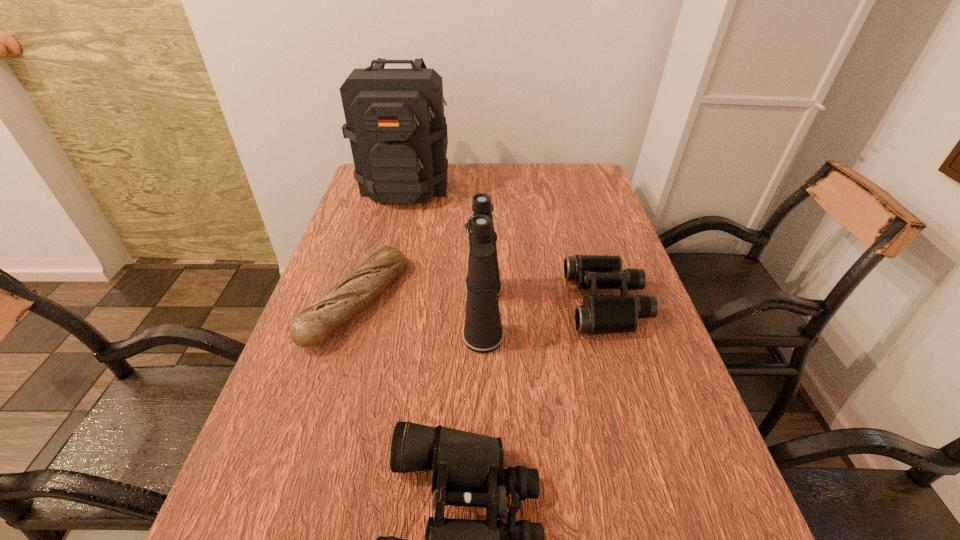
At what (x,y) coordinates should I click in order to perform the action: click on vacant space that satisfies the following two spatial constraints: 1. on the front side of the fourth shortest object; 2. on the right side of the baguet. Please return your answer as a coordinate pair (x, y). Looking at the image, I should click on tap(353, 314).